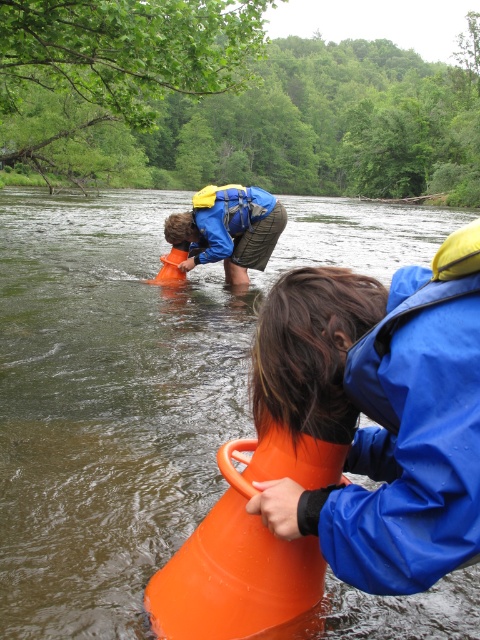
You are standing at the riverbank and need to hand an item to the person in the blue waterproof jacket at lower right. Which direction should you walk to reach them from the matte blue jacket at center?

The blue waterproof jacket at lower right is positioned on the right side of the matte blue jacket at center, so you should walk to the right to reach them.

You are a hiker who needs to cross a river using a narrow bridge. The bridge has a width of 1 meter. You have two items with you from the scene described. Which item, the orange plastic cone at center or the matte blue jacket at center, would allow you to safely carry across the bridge without exceeding its width?

The matte blue jacket at center has a smaller width than the orange plastic cone at center. Since the bridge is 1 meter wide, the matte blue jacket at center is narrower and would fit safely within the bridge width.

You are a hiker who needs to choose between the orange plastic cone at center and the blue waterproof jacket at lower right to carry water. Which object can hold more water?

The orange plastic cone at center has a larger size compared to the blue waterproof jacket at lower right, so it can hold more water.